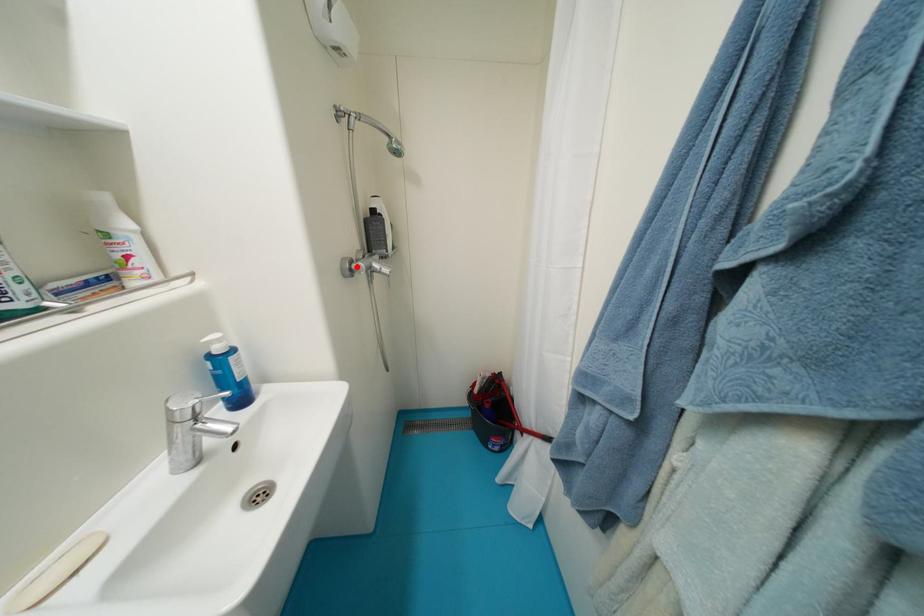
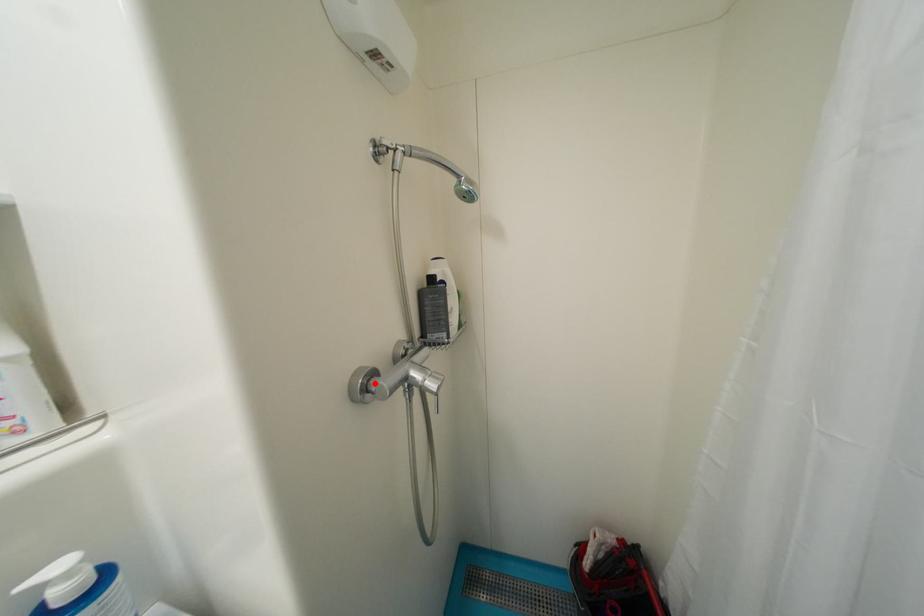
I am providing you with two images of the same scene from different viewpoints. A red point is marked on the first image and another point is marked on the second image. Is the red point in image1 aligned with the point shown in image2?

Yes